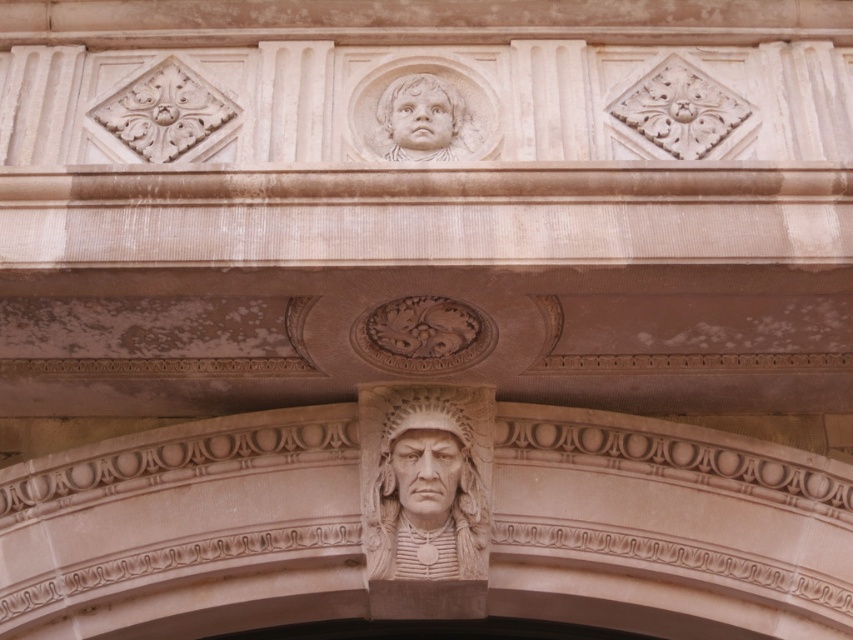
You are an architect examining the facade and want to determine which of the two points, point (x=401, y=131) or point (x=425, y=84), is closer to you. Based on the image, which point is nearer?

Point (x=401, y=131) is closer to the viewer than point (x=425, y=84).

You are an architect examining the building facade. You notice a point marked at coordinates (421, 116). Based on the scene description, what does this point likely represent?

The point at (421, 116) indicates the location of a smooth beige stone head at upper center, which is part of the decorative elements on the building facade.